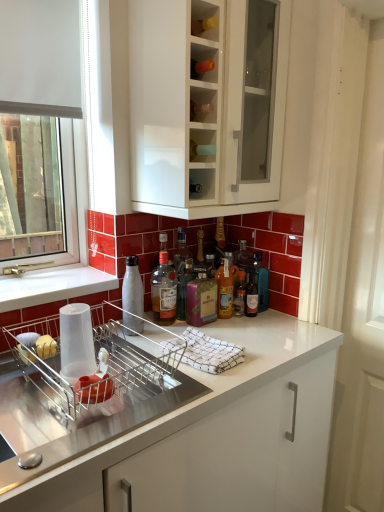
Question: Can you confirm if translucent glass bottle at center, placed as the first bottle when sorted from right to left, is taller than white glossy cabinet at upper center?

Choices:
 (A) no
 (B) yes

Answer: (A)

Question: Is the surface of translucent glass bottle at center, placed as the first bottle when sorted from right to left, in direct contact with white glossy cabinet at upper center?

Choices:
 (A) yes
 (B) no

Answer: (B)

Question: Would you consider translucent glass bottle at center, marked as the 6th bottle in a left-to-right arrangement, to be distant from white glossy cabinet at upper center?

Choices:
 (A) yes
 (B) no

Answer: (B)

Question: Considering the relative sizes of translucent glass bottle at center, marked as the 6th bottle in a left-to-right arrangement, and white glossy cabinet at upper center in the image provided, is translucent glass bottle at center, marked as the 6th bottle in a left-to-right arrangement, smaller than white glossy cabinet at upper center?

Choices:
 (A) yes
 (B) no

Answer: (A)

Question: Does translucent glass bottle at center, marked as the 6th bottle in a left-to-right arrangement, have a lesser width compared to white glossy cabinet at upper center?

Choices:
 (A) no
 (B) yes

Answer: (B)

Question: From their relative heights in the image, would you say translucent glass bottle at center, acting as the 5th bottle starting from the right, is taller or shorter than translucent glass bottle at center, arranged as the second bottle when viewed from the right?

Choices:
 (A) tall
 (B) short

Answer: (A)

Question: Would you say translucent glass bottle at center, acting as the 5th bottle starting from the right, is inside or outside translucent glass bottle at center, marked as the fifth bottle in a left-to-right arrangement?

Choices:
 (A) outside
 (B) inside

Answer: (A)

Question: From a real-world perspective, is translucent glass bottle at center, the second bottle from the left, above or below translucent glass bottle at center, arranged as the second bottle when viewed from the right?

Choices:
 (A) above
 (B) below

Answer: (A)

Question: Considering their positions, is translucent glass bottle at center, the second bottle from the left, located in front of or behind translucent glass bottle at center, arranged as the second bottle when viewed from the right?

Choices:
 (A) behind
 (B) front

Answer: (B)

Question: In terms of width, does white matte bottle at sink, placed as the 1th bottle when sorted from left to right, look wider or thinner when compared to white glossy cabinet at upper center?

Choices:
 (A) thin
 (B) wide

Answer: (A)

Question: From a real-world perspective, is white matte bottle at sink, placed as the 1th bottle when sorted from left to right, physically located above or below white glossy cabinet at upper center?

Choices:
 (A) below
 (B) above

Answer: (A)

Question: Is white matte bottle at sink, the sixth bottle from the right, inside or outside of white glossy cabinet at upper center?

Choices:
 (A) inside
 (B) outside

Answer: (B)

Question: From their relative heights in the image, would you say white matte bottle at sink, placed as the 1th bottle when sorted from left to right, is taller or shorter than white glossy cabinet at upper center?

Choices:
 (A) short
 (B) tall

Answer: (A)

Question: From the image's perspective, relative to translucent glass bottle at center, marked as the 6th bottle in a left-to-right arrangement, is purple glass bottle at center, placed as the 4th bottle when sorted from right to left, above or below?

Choices:
 (A) below
 (B) above

Answer: (A)

Question: In the image, is purple glass bottle at center, placed as the 4th bottle when sorted from right to left, positioned in front of or behind translucent glass bottle at center, placed as the first bottle when sorted from right to left?

Choices:
 (A) behind
 (B) front

Answer: (B)